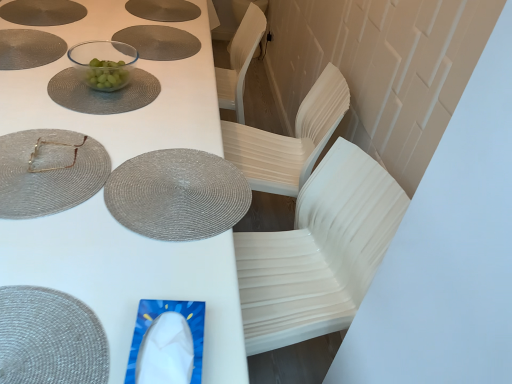
Locate an element on the screen. vacant area that lies between matte woven placemat at upper left, arranged as the 1th glass plate when ordered from the bottom, and clear glass bowl at upper center, placed as the fourth tableware when sorted from bottom to top is located at coordinates (73, 109).